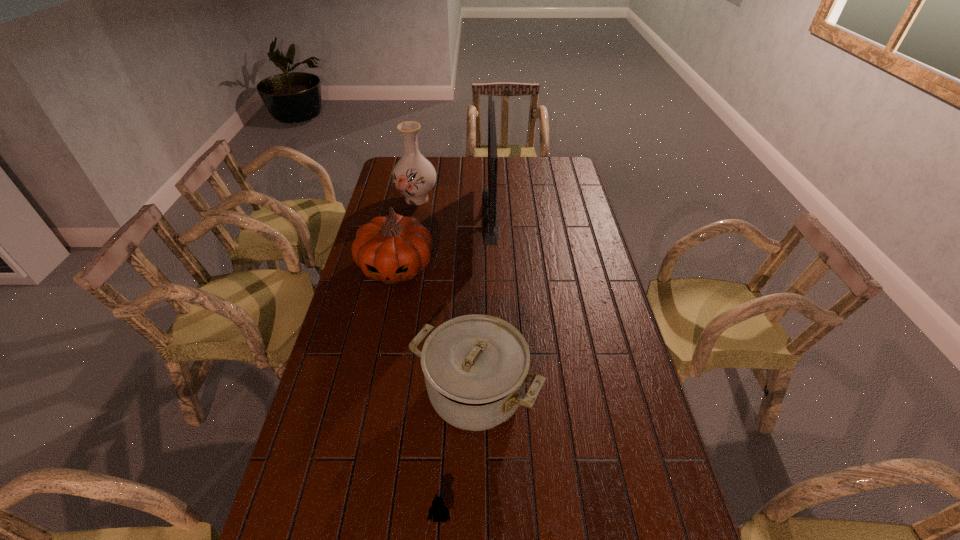
Locate an element on the screen. This screenshot has width=960, height=540. vacant space located on the back of the fourth shortest object is located at coordinates (422, 167).

I want to click on free space located on the face of the third shortest object, so pos(389,305).

Where is `vacant point located 0.300m on the right of the second nearest object`? vacant point located 0.300m on the right of the second nearest object is located at coordinates (644, 393).

The image size is (960, 540). Find the location of `vase positioned at the left edge`. vase positioned at the left edge is located at coordinates (414, 176).

Image resolution: width=960 pixels, height=540 pixels. What are the coordinates of `pumpkin that is positioned at the left edge` in the screenshot? It's located at (391, 249).

Locate an element on the screen. The width and height of the screenshot is (960, 540). vacant space at the far edge of the desktop is located at coordinates (457, 174).

Identify the location of free location at the left edge of the desktop. (356, 362).

Where is `free space at the right edge`? Image resolution: width=960 pixels, height=540 pixels. free space at the right edge is located at coordinates (565, 237).

The image size is (960, 540). I want to click on unoccupied position between the second tallest object and the monitor, so click(x=453, y=206).

The height and width of the screenshot is (540, 960). I want to click on vacant area that lies between the second tallest object and the monitor, so click(x=453, y=206).